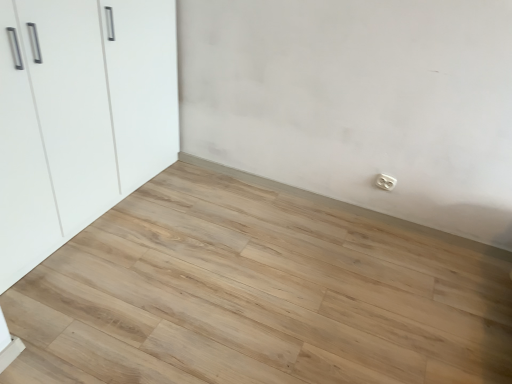
Question: Considering the relative sizes of natural wood floor at center and white glossy cupboard at left in the image provided, is natural wood floor at center thinner than white glossy cupboard at left?

Choices:
 (A) yes
 (B) no

Answer: (B)

Question: Considering the relative positions of natural wood floor at center and white glossy cupboard at left in the image provided, is natural wood floor at center to the left of white glossy cupboard at left from the viewer's perspective?

Choices:
 (A) no
 (B) yes

Answer: (A)

Question: Does natural wood floor at center have a larger size compared to white glossy cupboard at left?

Choices:
 (A) no
 (B) yes

Answer: (A)

Question: From the image's perspective, is natural wood floor at center located above white glossy cupboard at left?

Choices:
 (A) no
 (B) yes

Answer: (A)

Question: From a real-world perspective, is natural wood floor at center under white glossy cupboard at left?

Choices:
 (A) yes
 (B) no

Answer: (A)

Question: Is natural wood floor at center not within white glossy cupboard at left?

Choices:
 (A) yes
 (B) no

Answer: (A)

Question: From a real-world perspective, is white plastic electric outlet at lower right on top of white glossy cupboard at left?

Choices:
 (A) yes
 (B) no

Answer: (B)

Question: Is white glossy cupboard at left surrounded by white plastic electric outlet at lower right?

Choices:
 (A) no
 (B) yes

Answer: (A)

Question: From the image's perspective, is white plastic electric outlet at lower right on white glossy cupboard at left?

Choices:
 (A) no
 (B) yes

Answer: (A)

Question: Is white plastic electric outlet at lower right touching white glossy cupboard at left?

Choices:
 (A) yes
 (B) no

Answer: (B)

Question: Does white plastic electric outlet at lower right have a lesser height compared to white glossy cupboard at left?

Choices:
 (A) yes
 (B) no

Answer: (A)

Question: Can you confirm if white plastic electric outlet at lower right is taller than white glossy cupboard at left?

Choices:
 (A) yes
 (B) no

Answer: (B)

Question: Is white glossy cupboard at left oriented towards white plastic electric outlet at lower right?

Choices:
 (A) no
 (B) yes

Answer: (B)